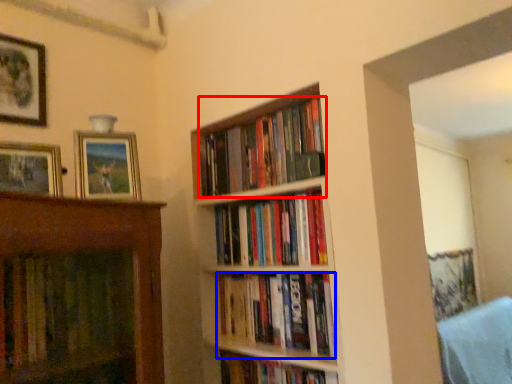
Question: Which object is closer to the camera taking this photo, book (highlighted by a red box) or book (highlighted by a blue box)?

Choices:
 (A) book
 (B) book

Answer: (B)